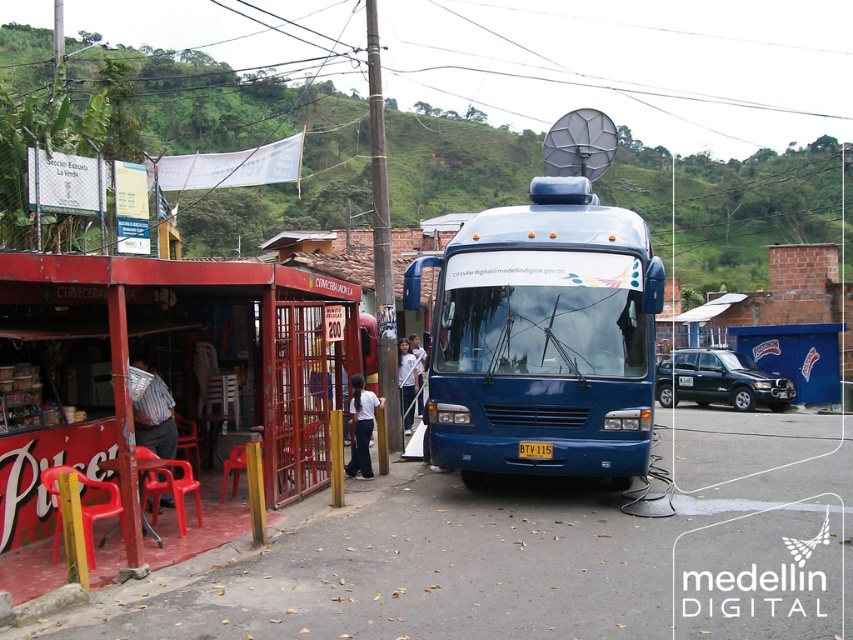
Question: Estimate the real-world distances between objects in this image. Which object is closer to the striped fabric shirt at lower left?

Choices:
 (A) plastic chairs at lower left
 (B) blue metallic bus at center
 (C) white matte shirt at center

Answer: (A)

Question: Does plastic chairs at lower left appear over blue metallic bus at center?

Choices:
 (A) no
 (B) yes

Answer: (A)

Question: Based on their relative distances, which object is nearer to the white matte shirt at center?

Choices:
 (A) blue metallic bus at center
 (B) plastic chairs at lower left
 (C) matte black food truck at center
 (D) striped fabric shirt at lower left

Answer: (B)

Question: Which point is closer to the camera?

Choices:
 (A) white matte shirt at center
 (B) plastic chairs at lower left
 (C) matte black food truck at center

Answer: (B)

Question: Can you confirm if striped fabric shirt at lower left is wider than white matte shirt at center?

Choices:
 (A) yes
 (B) no

Answer: (A)

Question: Is matte black food truck at center behind striped fabric shirt at lower left?

Choices:
 (A) no
 (B) yes

Answer: (B)